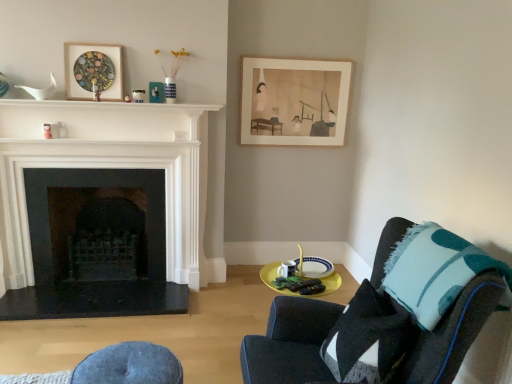
At what (x,y) coordinates should I click in order to perform the action: click on vacant space in wooden stained picture frame at upper left, which ranks as the 1th picture frame in left-to-right order (from a real-world perspective). Please return your answer as a coordinate pair (x, y). This screenshot has height=384, width=512. Looking at the image, I should click on (94, 105).